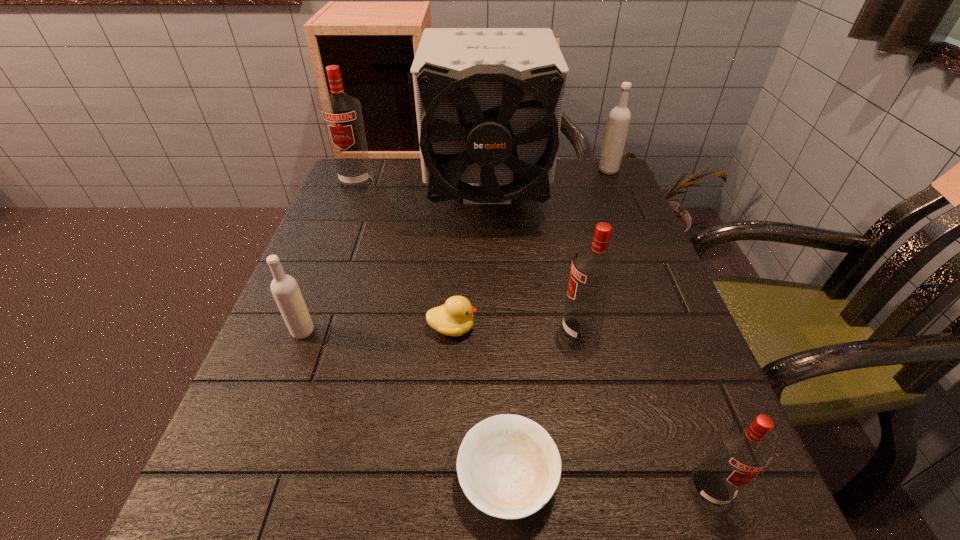
At what (x,y) coordinates should I click in order to perform the action: click on vacant space situated on the front label of the third vodka from right to left. Please return your answer as a coordinate pair (x, y). This screenshot has width=960, height=540. Looking at the image, I should click on (478, 332).

This screenshot has width=960, height=540. I want to click on free region located 0.310m on the front label of the third vodka from right to left, so click(391, 332).

Locate an element on the screen. This screenshot has height=540, width=960. vacant position located 0.360m on the back of the nearer white vodka is located at coordinates (348, 213).

You are a GUI agent. You are given a task and a screenshot of the screen. Output one action in this format:
    pyautogui.click(x=<x>, y=<y>)
    Task: Click on the free spot located on the beak of the seventh tallest object
    Image resolution: width=960 pixels, height=540 pixels.
    Given the screenshot: What is the action you would take?
    pyautogui.click(x=520, y=328)

What are the coordinates of `vacant space located 0.250m on the back of the beige bowl` in the screenshot? It's located at (500, 311).

Where is `fan that is positioned at the far edge`? Image resolution: width=960 pixels, height=540 pixels. fan that is positioned at the far edge is located at coordinates (489, 101).

Locate an element on the screen. This screenshot has width=960, height=540. vodka that is at the near edge is located at coordinates (741, 451).

Identify the location of bowl located at the near edge. This screenshot has width=960, height=540. (508, 466).

Where is `object present at the far left corner`? This screenshot has height=540, width=960. object present at the far left corner is located at coordinates (342, 114).

At what (x,y) coordinates should I click in order to perform the action: click on object at the far right corner. Please return your answer as a coordinate pair (x, y). The width and height of the screenshot is (960, 540). Looking at the image, I should click on (619, 118).